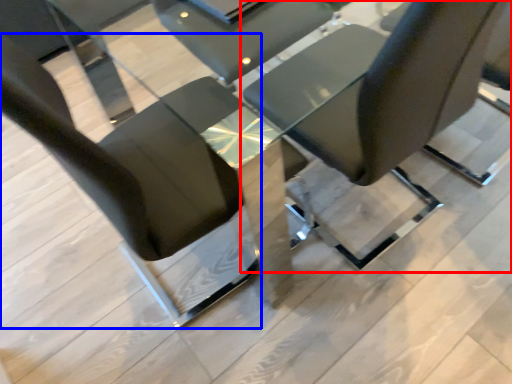
Question: Which object is further to the camera taking this photo, chair (highlighted by a red box) or chair (highlighted by a blue box)?

Choices:
 (A) chair
 (B) chair

Answer: (A)